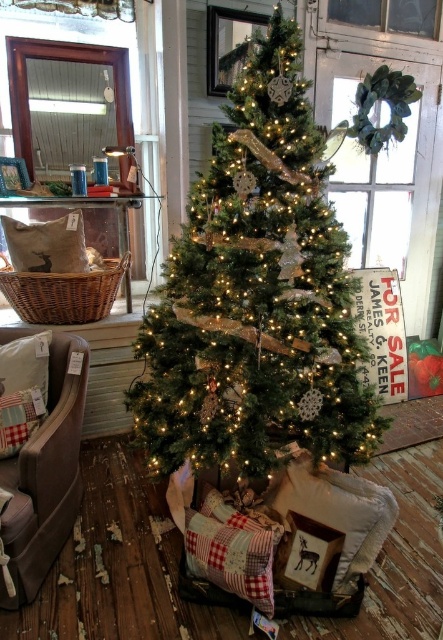
Is green matte christmas tree at center positioned in front of velvet beige armchair at lower left?

No.

Is green matte christmas tree at center further to camera compared to velvet beige armchair at lower left?

Yes.

What are the coordinates of `green matte christmas tree at center` in the screenshot? It's located at (256, 296).

This screenshot has width=443, height=640. Identify the location of green matte christmas tree at center. (256, 296).